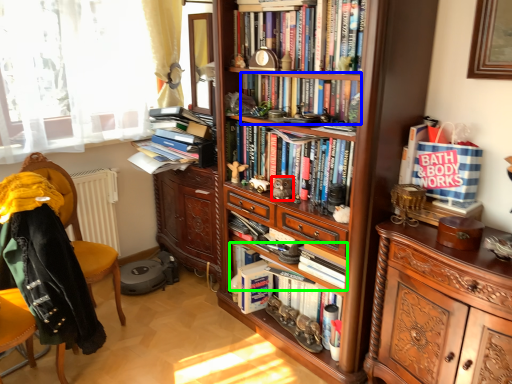
Question: Estimate the real-world distances between objects in this image. Which object is farther from toy (highlighted by a red box), book (highlighted by a blue box) or book (highlighted by a green box)?

Choices:
 (A) book
 (B) book

Answer: (A)